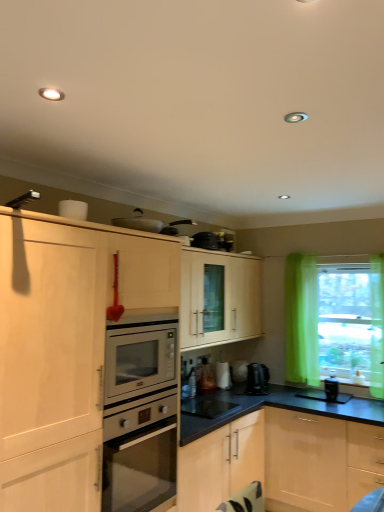
Question: From the image's perspective, is translucent green curtain at right above or below black plastic coffee maker at lower right, which is the fourth appliance in left-to-right order?

Choices:
 (A) above
 (B) below

Answer: (A)

Question: Choose the correct answer: Is translucent green curtain at right inside black plastic coffee maker at lower right, placed as the second appliance when sorted from bottom to top, or outside it?

Choices:
 (A) inside
 (B) outside

Answer: (B)

Question: Based on their relative distances, which object is nearer to the black glossy microwave at center, the 2th appliance when ordered from front to back?

Choices:
 (A) translucent green curtain at right
 (B) satin black coffee machine at lower center
 (C) black plastic coffee maker at lower right, the 2th appliance in the back-to-front sequence
 (D) metallic silver toaster at upper center, the 4th appliance positioned from the bottom
 (E) white glossy kettle at lower center, arranged as the 1th appliance when viewed from the back

Answer: (E)

Question: Based on their relative distances, which object is nearer to the metallic silver toaster at upper center, the 4th appliance positioned from the bottom?

Choices:
 (A) satin black coffee machine at lower center
 (B) translucent green curtain at right
 (C) black plastic coffee maker at lower right, the 2th appliance in the back-to-front sequence
 (D) white glossy kettle at lower center, acting as the second appliance starting from the top
 (E) black glossy microwave at center, the 2th appliance when ordered from front to back

Answer: (E)